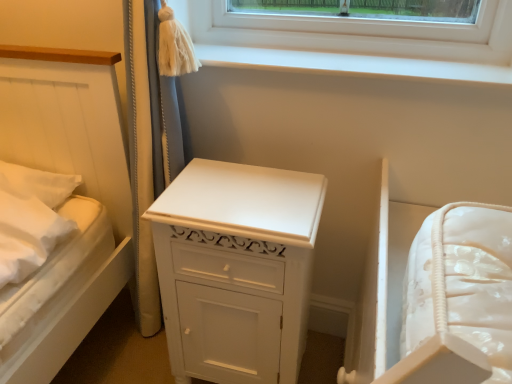
Question: Does white painted wood chest of drawers at center have a larger size compared to white smooth window sill at upper center?

Choices:
 (A) no
 (B) yes

Answer: (B)

Question: Considering the relative sizes of white painted wood chest of drawers at center and white smooth window sill at upper center in the image provided, is white painted wood chest of drawers at center shorter than white smooth window sill at upper center?

Choices:
 (A) yes
 (B) no

Answer: (B)

Question: Considering the relative positions of white painted wood chest of drawers at center and white smooth window sill at upper center in the image provided, is white painted wood chest of drawers at center to the right of white smooth window sill at upper center from the viewer's perspective?

Choices:
 (A) yes
 (B) no

Answer: (B)

Question: Does white painted wood chest of drawers at center have a smaller size compared to white smooth window sill at upper center?

Choices:
 (A) yes
 (B) no

Answer: (B)

Question: Does white painted wood chest of drawers at center turn towards white smooth window sill at upper center?

Choices:
 (A) no
 (B) yes

Answer: (A)

Question: Considering the relative positions of white painted wood chest of drawers at center and white smooth window sill at upper center in the image provided, is white painted wood chest of drawers at center to the left of white smooth window sill at upper center from the viewer's perspective?

Choices:
 (A) no
 (B) yes

Answer: (B)

Question: Does white smooth window sill at upper center appear on the left side of white painted wood chest of drawers at center?

Choices:
 (A) yes
 (B) no

Answer: (B)

Question: Would you consider white smooth window sill at upper center to be distant from white painted wood chest of drawers at center?

Choices:
 (A) yes
 (B) no

Answer: (B)

Question: Is white smooth window sill at upper center closer to the viewer compared to white painted wood chest of drawers at center?

Choices:
 (A) yes
 (B) no

Answer: (B)

Question: From the image's perspective, is white smooth window sill at upper center on top of white painted wood chest of drawers at center?

Choices:
 (A) yes
 (B) no

Answer: (A)

Question: Can you confirm if white smooth window sill at upper center is wider than white painted wood chest of drawers at center?

Choices:
 (A) yes
 (B) no

Answer: (B)

Question: Does white smooth window sill at upper center have a larger size compared to white painted wood chest of drawers at center?

Choices:
 (A) yes
 (B) no

Answer: (B)

Question: From the image's perspective, is white smooth window sill at upper center above or below white painted wood chest of drawers at center?

Choices:
 (A) above
 (B) below

Answer: (A)